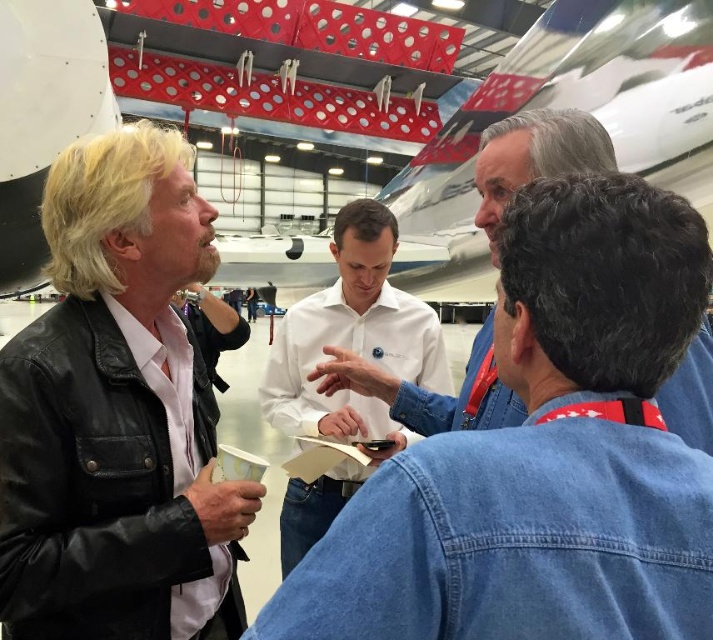
Does denim jacket at center lie in front of denim shirt at center?

Yes.

Which is in front, point (585, 211) or point (366, 376)?

Point (585, 211) is in front.

Does point (523, 280) lie behind point (361, 378)?

No, it is not.

Image resolution: width=713 pixels, height=640 pixels. I want to click on denim jacket at center, so click(x=543, y=454).

Does white glossy airplane at upper center lie in front of white shirt at center?

No, it is behind white shirt at center.

Does white glossy airplane at upper center appear under white shirt at center?

No.

Which is behind, point (420, 200) or point (342, 259)?

Point (420, 200)

You are a GUI agent. You are given a task and a screenshot of the screen. Output one action in this format:
    pyautogui.click(x=<x>, y=<y>)
    Task: Click on the white glossy airplane at upper center
    
    Given the screenshot: What is the action you would take?
    pyautogui.click(x=560, y=106)

Find the location of a particular element. white shirt at center is located at coordinates (353, 337).

Does white shirt at center have a greater height compared to denim shirt at center?

Yes, white shirt at center is taller than denim shirt at center.

Which is behind, point (332, 284) or point (545, 141)?

The point (332, 284) is more distant.

Locate an element on the screen. This screenshot has width=713, height=640. white shirt at center is located at coordinates (353, 337).